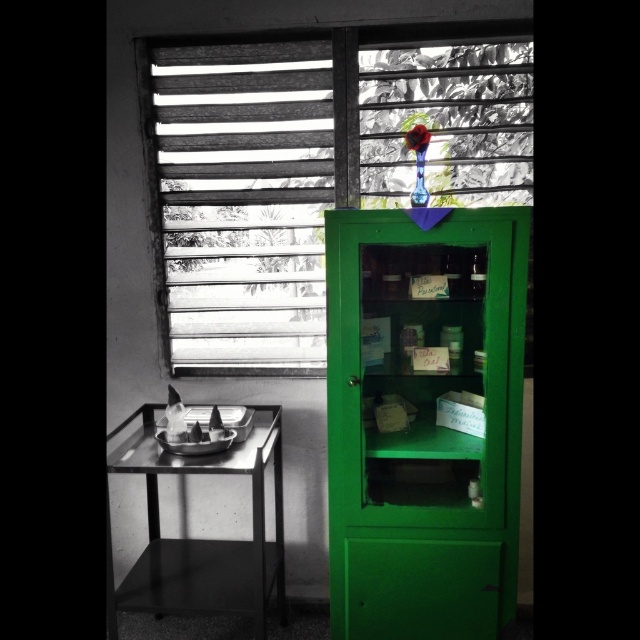
Question: Can you confirm if wooden slats at upper center is wider than metallic black table at left?

Choices:
 (A) no
 (B) yes

Answer: (B)

Question: Is wooden slats at upper center further to camera compared to metallic black table at left?

Choices:
 (A) yes
 (B) no

Answer: (A)

Question: Is wooden slats at upper center bigger than metallic black table at left?

Choices:
 (A) yes
 (B) no

Answer: (A)

Question: Among these points, which one is nearest to the camera?

Choices:
 (A) (492, 40)
 (B) (129, 445)

Answer: (B)